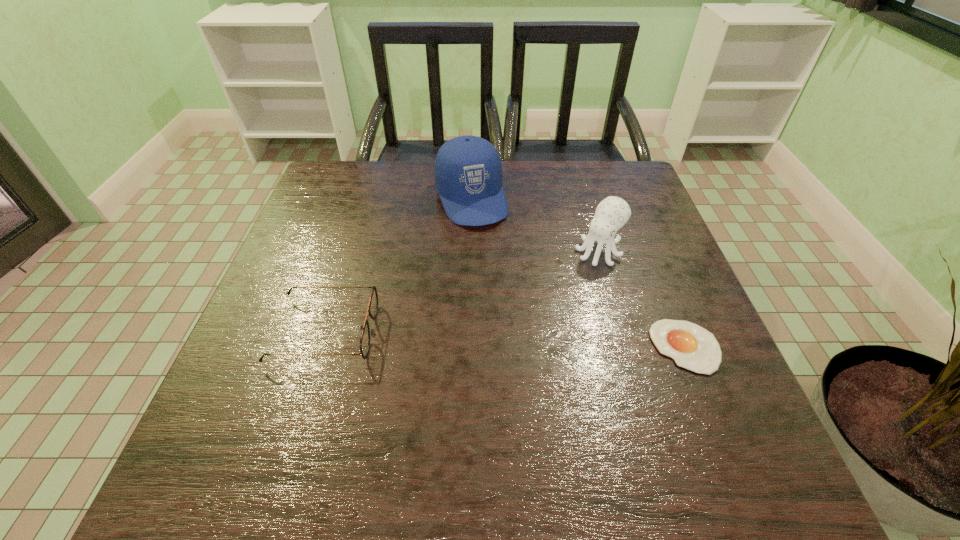
Identify the location of vacant space located on the front-facing side of the farthest object. (522, 323).

Identify the location of free spot located on the front-facing side of the third nearest object. (483, 376).

This screenshot has height=540, width=960. What are the coordinates of `vacant space situated 0.190m on the front-facing side of the third nearest object` in the screenshot? It's located at click(542, 313).

At what (x,y) coordinates should I click in order to perform the action: click on vacant space located 0.090m on the front-facing side of the third nearest object. Please return your answer as a coordinate pair (x, y). Looking at the image, I should click on (567, 286).

Identify the location of object situated at the far edge. This screenshot has width=960, height=540. (468, 173).

Locate an element on the screen. This screenshot has width=960, height=540. object that is at the left edge is located at coordinates (373, 303).

Identify the location of egg yolk situated at the right edge. The height and width of the screenshot is (540, 960). (692, 347).

Find the location of a particular element. The height and width of the screenshot is (540, 960). octopus that is at the right edge is located at coordinates pyautogui.click(x=612, y=213).

This screenshot has height=540, width=960. I want to click on vacant space at the far edge of the desktop, so click(588, 204).

Where is `vacant space at the near edge of the desktop`? The height and width of the screenshot is (540, 960). vacant space at the near edge of the desktop is located at coordinates (631, 401).